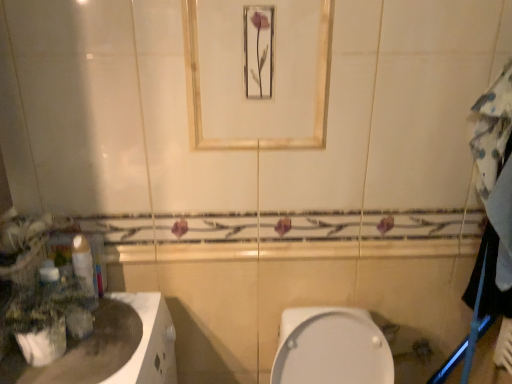
The height and width of the screenshot is (384, 512). Find the location of `empty space that is ontop of white glossy countertop at lower left (from a real-world perspective)`. empty space that is ontop of white glossy countertop at lower left (from a real-world perspective) is located at coordinates (x=77, y=347).